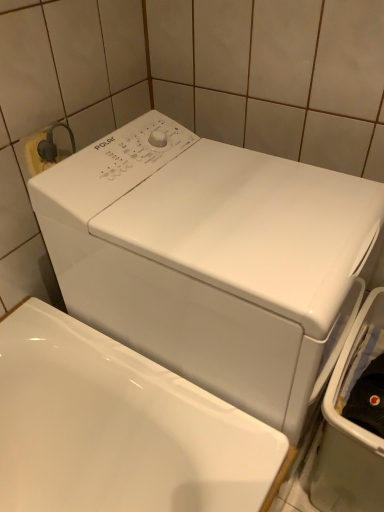
Measure the distance between point (341, 492) and camera.

The depth of point (341, 492) is 3.41 feet.

Measure the distance between white glossy dishwasher at right and camera.

The distance of white glossy dishwasher at right from camera is 32.37 inches.

Locate an element on the screen. Image resolution: width=384 pixels, height=512 pixels. white glossy dishwasher at right is located at coordinates (345, 435).

The height and width of the screenshot is (512, 384). What do you see at coordinates (345, 435) in the screenshot?
I see `white glossy dishwasher at right` at bounding box center [345, 435].

The width and height of the screenshot is (384, 512). What do you see at coordinates (213, 259) in the screenshot?
I see `white glossy washing machine at center` at bounding box center [213, 259].

The width and height of the screenshot is (384, 512). Identify the location of white glossy washing machine at center. (213, 259).

Locate an element on the screen. white glossy dishwasher at right is located at coordinates (345, 435).

In the image, is white glossy dishwasher at right on the left side or the right side of white glossy washing machine at center?

white glossy dishwasher at right is to the right of white glossy washing machine at center.

Does white glossy dishwasher at right lie behind white glossy washing machine at center?

That is True.

Is point (346, 385) positioned after point (168, 149)?

Yes, it is.

From the image's perspective, is white glossy dishwasher at right located above white glossy washing machine at center?

Actually, white glossy dishwasher at right appears below white glossy washing machine at center in the image.

From a real-world perspective, is white glossy dishwasher at right on top of white glossy washing machine at center?

No.

Considering the relative sizes of white glossy dishwasher at right and white glossy washing machine at center in the image provided, is white glossy dishwasher at right wider than white glossy washing machine at center?

In fact, white glossy dishwasher at right might be narrower than white glossy washing machine at center.

Considering the sizes of objects white glossy dishwasher at right and white glossy washing machine at center in the image provided, who is shorter, white glossy dishwasher at right or white glossy washing machine at center?

white glossy dishwasher at right.

In the scene shown: In terms of size, does white glossy dishwasher at right appear bigger or smaller than white glossy washing machine at center?

Clearly, white glossy dishwasher at right is smaller in size than white glossy washing machine at center.

Is white glossy washing machine at center completely or partially inside white glossy dishwasher at right?

Definitely not — white glossy washing machine at center is not inside white glossy dishwasher at right.

Is the surface of white glossy dishwasher at right in direct contact with white glossy washing machine at center?

No, white glossy dishwasher at right is not in contact with white glossy washing machine at center.

Is white glossy dishwasher at right aimed at white glossy washing machine at center?

No.

How different are the orientations of white glossy dishwasher at right and white glossy washing machine at center in degrees?

They differ by 90 degrees in their facing directions.

What are the coordinates of `washing machine located above the white glossy dishwasher at right (from the image's perspective)` in the screenshot? It's located at (213, 259).

In the image, is white glossy washing machine at center on the left side or the right side of white glossy dishwasher at right?

Clearly, white glossy washing machine at center is on the left of white glossy dishwasher at right in the image.

In the image, is white glossy washing machine at center positioned in front of or behind white glossy dishwasher at right?

white glossy washing machine at center is in front of white glossy dishwasher at right.

Does point (207, 385) come farther from viewer compared to point (369, 440)?

Yes, it is behind point (369, 440).

From the image's perspective, relative to white glossy dishwasher at right, is white glossy washing machine at center above or below?

white glossy washing machine at center is above white glossy dishwasher at right.

From a real-world perspective, is white glossy washing machine at center on top of white glossy dishwasher at right?

Indeed, from a real-world perspective, white glossy washing machine at center stands above white glossy dishwasher at right.

Considering the relative sizes of white glossy washing machine at center and white glossy dishwasher at right in the image provided, is white glossy washing machine at center thinner than white glossy dishwasher at right?

Incorrect, the width of white glossy washing machine at center is not less than that of white glossy dishwasher at right.

Is white glossy washing machine at center shorter than white glossy dishwasher at right?

No, white glossy washing machine at center is not shorter than white glossy dishwasher at right.

Between white glossy washing machine at center and white glossy dishwasher at right, which one has smaller size?

With smaller size is white glossy dishwasher at right.

Choose the correct answer: Is white glossy washing machine at center inside white glossy dishwasher at right or outside it?

white glossy washing machine at center lies outside white glossy dishwasher at right.

Consider the image. Would you say white glossy washing machine at center is a long distance from white glossy dishwasher at right?

white glossy washing machine at center is near white glossy dishwasher at right, not far away.

Is white glossy washing machine at center positioned with its back to white glossy dishwasher at right?

white glossy washing machine at center is not turned away from white glossy dishwasher at right.

What's the angular difference between white glossy washing machine at center and white glossy dishwasher at right's facing directions?

white glossy washing machine at center and white glossy dishwasher at right are facing 90 degrees away from each other.

I want to click on dish washer behind the white glossy washing machine at center, so click(x=345, y=435).

This screenshot has height=512, width=384. I want to click on washing machine located above the white glossy dishwasher at right (from the image's perspective), so click(x=213, y=259).

The height and width of the screenshot is (512, 384). I want to click on dish washer below the white glossy washing machine at center (from a real-world perspective), so click(x=345, y=435).